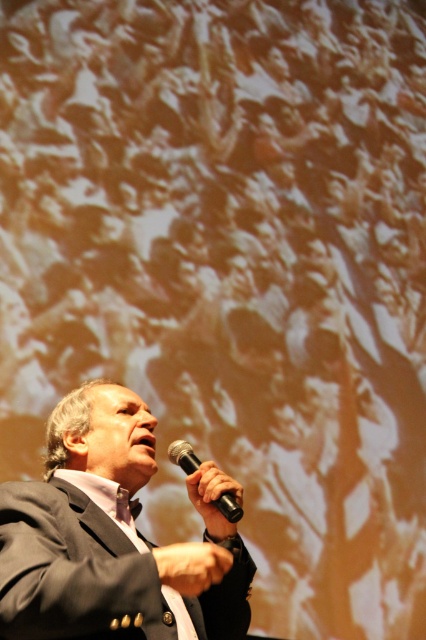
Question: Does dark gray suit at center appear on the left side of black matte microphone at center?

Choices:
 (A) no
 (B) yes

Answer: (B)

Question: Which point is closer to the camera?

Choices:
 (A) (31, 547)
 (B) (172, 442)

Answer: (A)

Question: Does dark gray suit at center appear under black matte microphone at center?

Choices:
 (A) no
 (B) yes

Answer: (B)

Question: Which object appears closest to the camera in this image?

Choices:
 (A) black matte microphone at center
 (B) dark gray suit at center

Answer: (B)

Question: Is dark gray suit at center to the left of black matte microphone at center from the viewer's perspective?

Choices:
 (A) yes
 (B) no

Answer: (A)